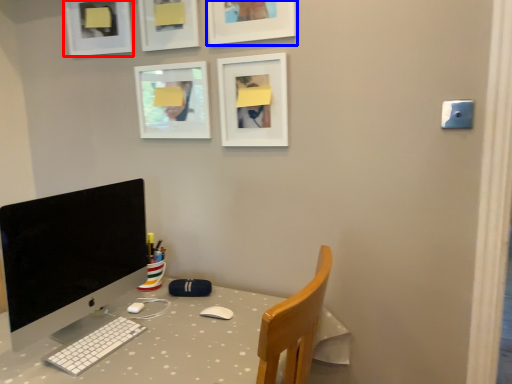
Question: Which object is closer to the camera taking this photo, picture frame (highlighted by a red box) or picture frame (highlighted by a blue box)?

Choices:
 (A) picture frame
 (B) picture frame

Answer: (B)